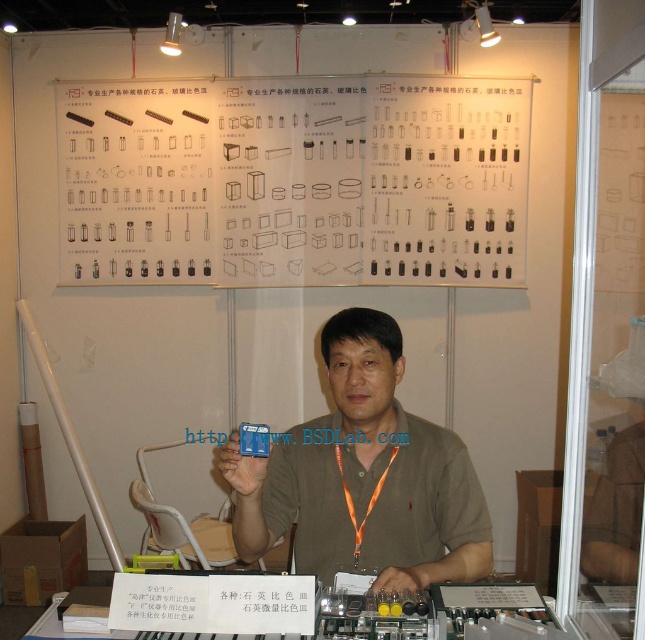
You are at a trade show and see two points marked on the large display board behind the man. Which point is closer to you, point (473,532) or point (352,602)?

Point (473,532) is further to the viewer than point (352,602), so point (352,602) is closer to you.

In the scene shown: You are at a trade show and see a man holding a small blue object. There is a point marked at coordinates (293, 180). Where is this point located relative to the white paper at upper center?

The point at (293, 180) is located on the white paper at upper center.